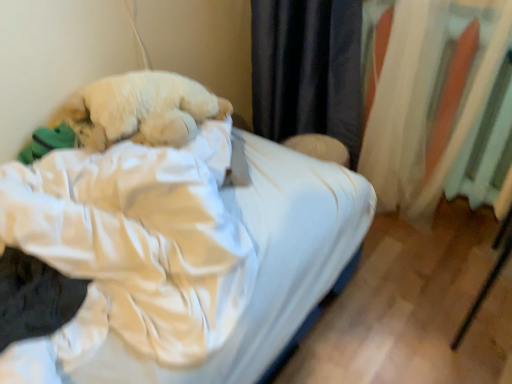
Question: From the image's perspective, would you say fluffy white dog at center is positioned over white satin bed at center?

Choices:
 (A) yes
 (B) no

Answer: (A)

Question: Is fluffy white dog at center facing towards white satin bed at center?

Choices:
 (A) no
 (B) yes

Answer: (B)

Question: From a real-world perspective, is fluffy white dog at center over white satin bed at center?

Choices:
 (A) yes
 (B) no

Answer: (A)

Question: Is fluffy white dog at center facing away from white satin bed at center?

Choices:
 (A) no
 (B) yes

Answer: (B)

Question: Does fluffy white dog at center have a lesser width compared to white satin bed at center?

Choices:
 (A) no
 (B) yes

Answer: (B)

Question: Relative to fluffy white dog at center, is white fabric curtain at right in front or behind?

Choices:
 (A) behind
 (B) front

Answer: (A)

Question: From their relative heights in the image, would you say white fabric curtain at right is taller or shorter than fluffy white dog at center?

Choices:
 (A) tall
 (B) short

Answer: (A)

Question: Would you say white fabric curtain at right is to the left or to the right of fluffy white dog at center in the picture?

Choices:
 (A) left
 (B) right

Answer: (B)

Question: From the image's perspective, is white fabric curtain at right located above or below fluffy white dog at center?

Choices:
 (A) above
 (B) below

Answer: (A)

Question: Based on their positions, is white fabric curtain at right located to the left or right of white satin bed at center?

Choices:
 (A) left
 (B) right

Answer: (B)

Question: From a real-world perspective, relative to white satin bed at center, is white fabric curtain at right vertically above or below?

Choices:
 (A) below
 (B) above

Answer: (B)

Question: Does point (400, 195) appear closer or farther from the camera than point (215, 206)?

Choices:
 (A) closer
 (B) farther

Answer: (B)

Question: From the image's perspective, is white fabric curtain at right above or below white satin bed at center?

Choices:
 (A) below
 (B) above

Answer: (B)

Question: Looking at their shapes, would you say fluffy white dog at center is wider or thinner than white fabric curtain at right?

Choices:
 (A) wide
 (B) thin

Answer: (A)

Question: In terms of height, does fluffy white dog at center look taller or shorter compared to white fabric curtain at right?

Choices:
 (A) tall
 (B) short

Answer: (B)